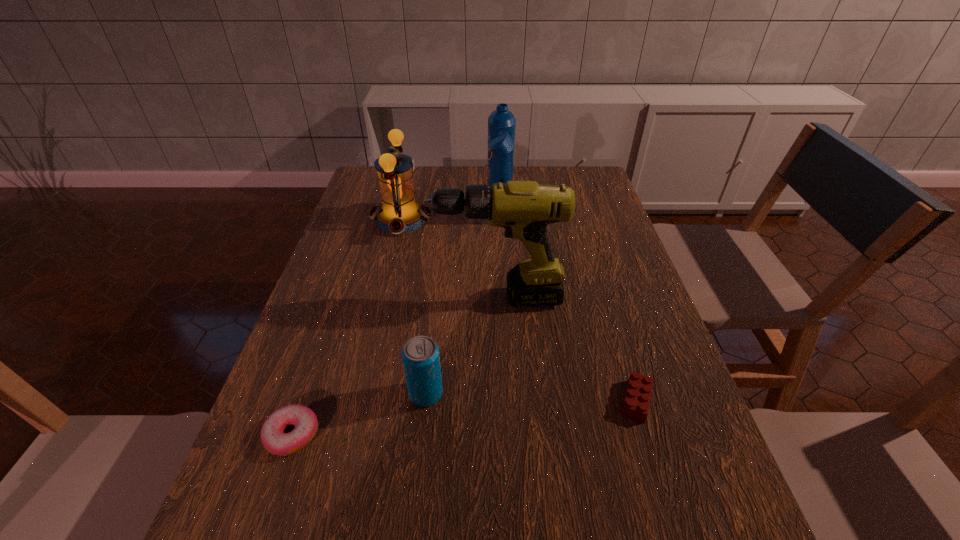
Image resolution: width=960 pixels, height=540 pixels. I want to click on shampoo, so click(x=501, y=123).

The image size is (960, 540). Find the location of `drill`. drill is located at coordinates (524, 208).

At what (x,y) coordinates should I click in order to perform the action: click on lantern. Please return your answer as a coordinate pair (x, y). Looking at the image, I should click on (400, 213).

Where is `the fourth tallest object`? the fourth tallest object is located at coordinates (420, 355).

Identify the location of doughnut. The width and height of the screenshot is (960, 540). (305, 421).

You are a GUI agent. You are given a task and a screenshot of the screen. Output one action in this format:
    pyautogui.click(x=<x>, y=<y>)
    Task: Click on the Lego
    
    Given the screenshot: What is the action you would take?
    pyautogui.click(x=637, y=398)

At what (x,y) coordinates should I click in order to perform the action: click on vacant region located 0.080m on the left of the shampoo. Please return your answer as a coordinate pair (x, y). The width and height of the screenshot is (960, 540). Looking at the image, I should click on (461, 222).

Find the location of `free region located 0.230m on the handle side of the fourth nearest object`. free region located 0.230m on the handle side of the fourth nearest object is located at coordinates (343, 298).

Find the location of a particular element. free point located 0.300m on the handle side of the fourth nearest object is located at coordinates (316, 298).

At what (x,y) coordinates should I click in order to perform the action: click on vacant area situated on the handle side of the fourth nearest object. Please return your answer as a coordinate pair (x, y). This screenshot has width=960, height=540. Looking at the image, I should click on (316, 298).